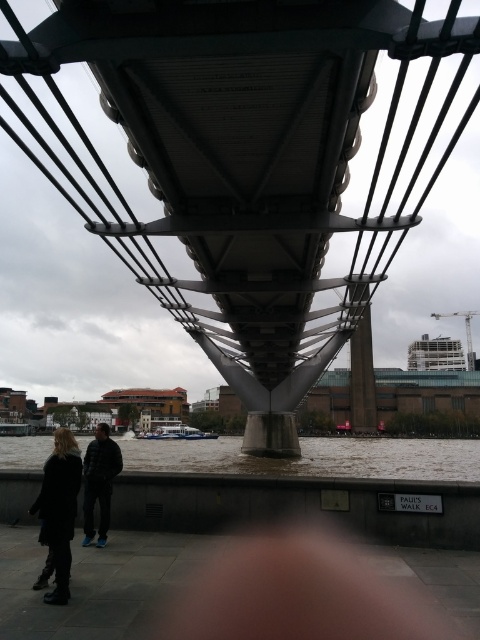
You are a photographer planning to capture the metallic gray suspension bridge at center and the brown water at lower center in a single shot. Based on their relative heights, which object should you focus on first to ensure both are in frame?

The metallic gray suspension bridge at center has a greater height compared to brown water at lower center, so you should focus on the metallic gray suspension bridge at center first to ensure both are in frame.

You are a photographer standing on the bridge and want to take a photo of the black wool coat at lower left and the dark gray jacket at lower left. Which one will be closer to the camera in the photo?

The black wool coat at lower left is in front of the dark gray jacket at lower left, so it will be closer to the camera in the photo.

You are a photographer planning to capture the reflection of the metallic gray suspension bridge at center in the brown water at lower center. Based on the scene description, can you confirm if the reflection is visible?

The metallic gray suspension bridge at center is positioned over brown water at lower center, so its reflection should be visible in the water below.